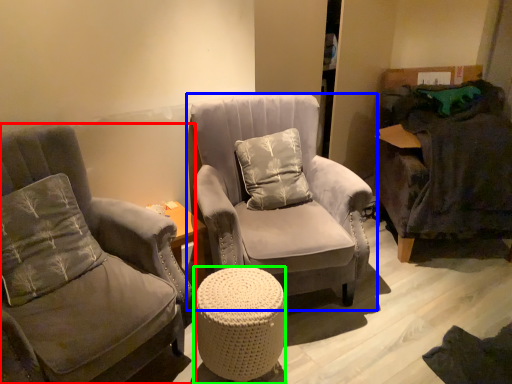
Question: Considering the real-world distances, which object is farthest from chair (highlighted by a red box)? chair (highlighted by a blue box) or table (highlighted by a green box)?

Choices:
 (A) chair
 (B) table

Answer: (A)